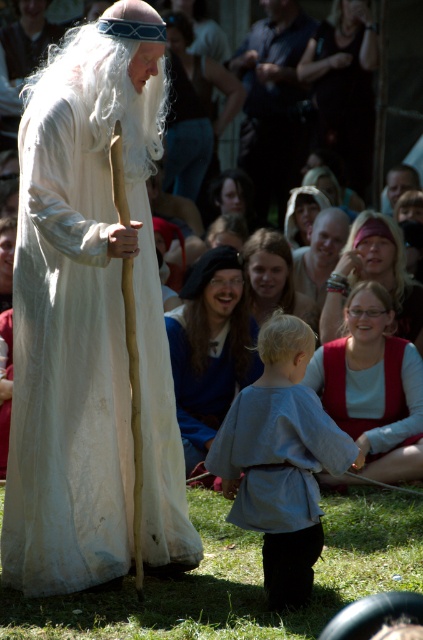
Question: Does red velvet vest at lower right have a greater width compared to dark fabric handbag at upper center?

Choices:
 (A) no
 (B) yes

Answer: (B)

Question: Which object is the farthest from the white cotton wig at center?

Choices:
 (A) dark fabric handbag at upper center
 (B) blonde hair at center

Answer: (A)

Question: Which of the following is the closest to the observer?

Choices:
 (A) (107, 90)
 (B) (209, 266)

Answer: (A)

Question: Which point is farther from the camera taking this photo?

Choices:
 (A) (112, 54)
 (B) (178, 22)

Answer: (B)

Question: Does red velvet vest at lower right have a larger size compared to matte pink vest at center?

Choices:
 (A) no
 (B) yes

Answer: (B)

Question: Is light blue fabric shirt at center above red velvet vest at lower right?

Choices:
 (A) yes
 (B) no

Answer: (B)